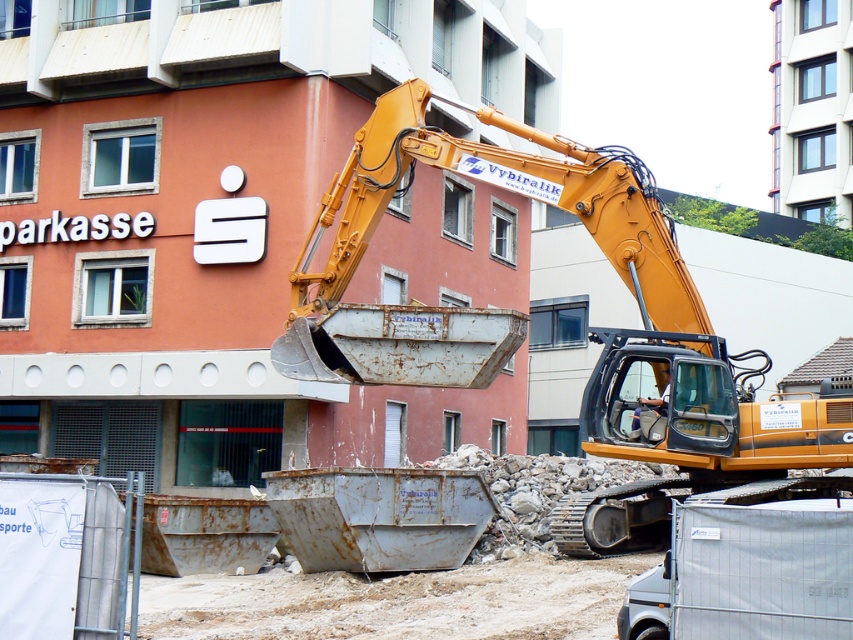
Question: Which of the following is the closest to the observer?

Choices:
 (A) light brown leather helmet at center
 (B) yellow metallic excavator at center

Answer: (B)

Question: Which object appears farthest from the camera in this image?

Choices:
 (A) light brown leather helmet at center
 (B) yellow metallic excavator at center

Answer: (A)

Question: Is yellow metallic excavator at center thinner than light brown leather helmet at center?

Choices:
 (A) no
 (B) yes

Answer: (A)

Question: Is yellow metallic excavator at center in front of light brown leather helmet at center?

Choices:
 (A) yes
 (B) no

Answer: (A)

Question: Is yellow metallic excavator at center wider than light brown leather helmet at center?

Choices:
 (A) yes
 (B) no

Answer: (A)

Question: Which point appears farthest from the camera in this image?

Choices:
 (A) (665, 404)
 (B) (633, 493)

Answer: (B)